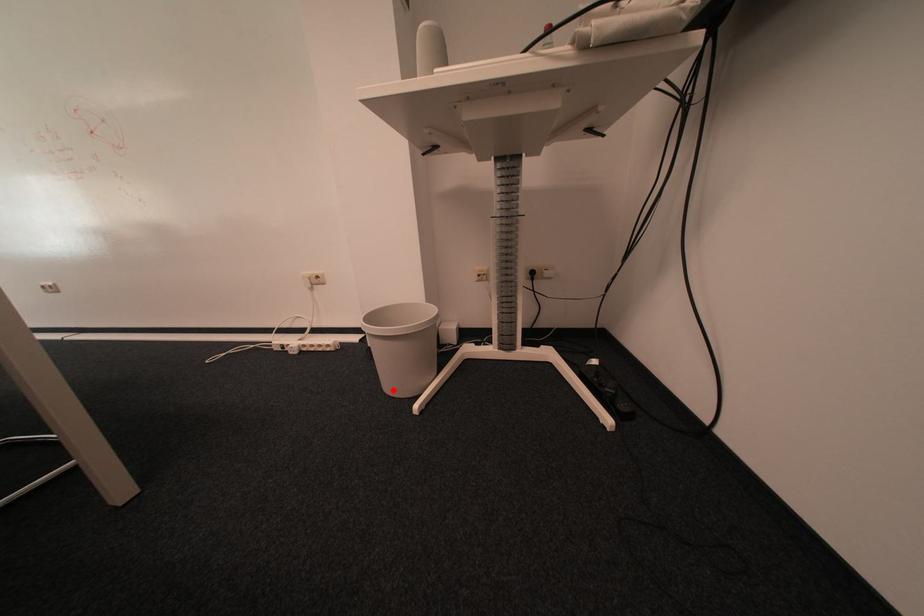
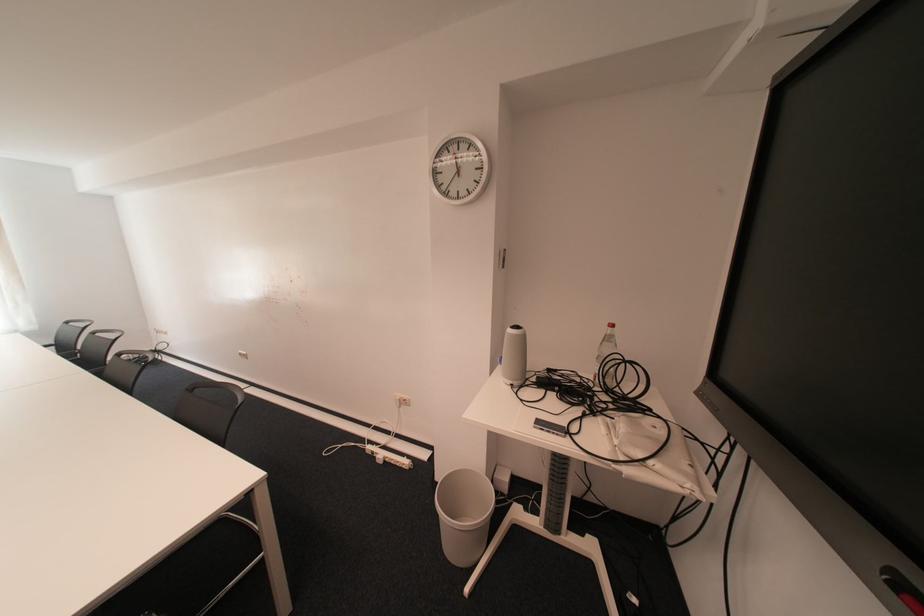
Question: I am providing you with two images of the same scene from different viewpoints. A red point is shown in image1. For the corresponding object point in image2, is it positioned nearer or farther from the camera?

Choices:
 (A) Nearer
 (B) Farther

Answer: (B)